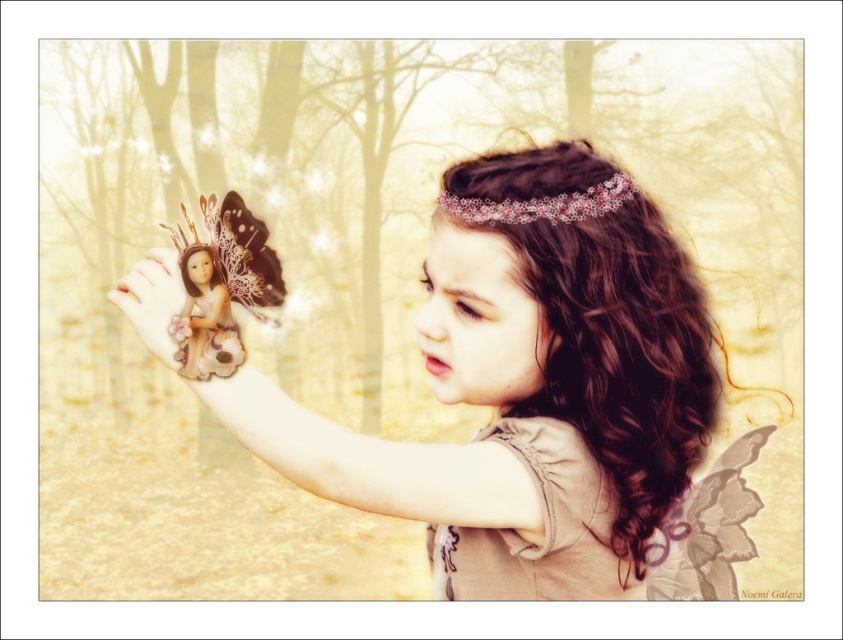
Question: Is the position of smooth porcelain doll at center less distant than that of smooth cream hand at lower left?

Choices:
 (A) no
 (B) yes

Answer: (B)

Question: Which point is farther from the camera taking this photo?

Choices:
 (A) (149, 280)
 (B) (283, 442)
 (C) (191, 314)

Answer: (A)

Question: Which of these objects is positioned closest to the matte brown fairy doll at upper left?

Choices:
 (A) smooth porcelain doll at center
 (B) pink lace tiara at upper center

Answer: (B)

Question: Is smooth porcelain doll at center to the right of smooth cream hand at lower left from the viewer's perspective?

Choices:
 (A) yes
 (B) no

Answer: (A)

Question: Which of the following is the farthest from the observer?

Choices:
 (A) smooth cream hand at lower left
 (B) matte brown fairy doll at upper left
 (C) smooth porcelain doll at center

Answer: (A)

Question: Is matte brown fairy doll at upper left above pink lace tiara at upper center?

Choices:
 (A) no
 (B) yes

Answer: (A)